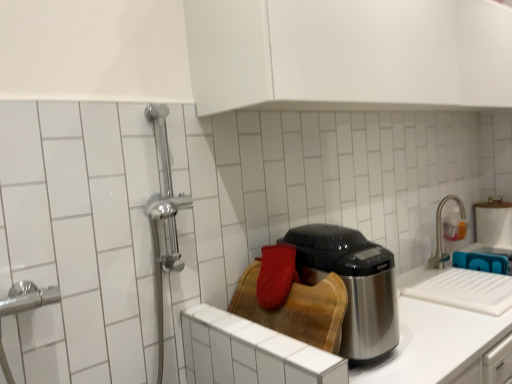
I want to click on free space above wooden cutting board at center (from a real-world perspective), so (258, 332).